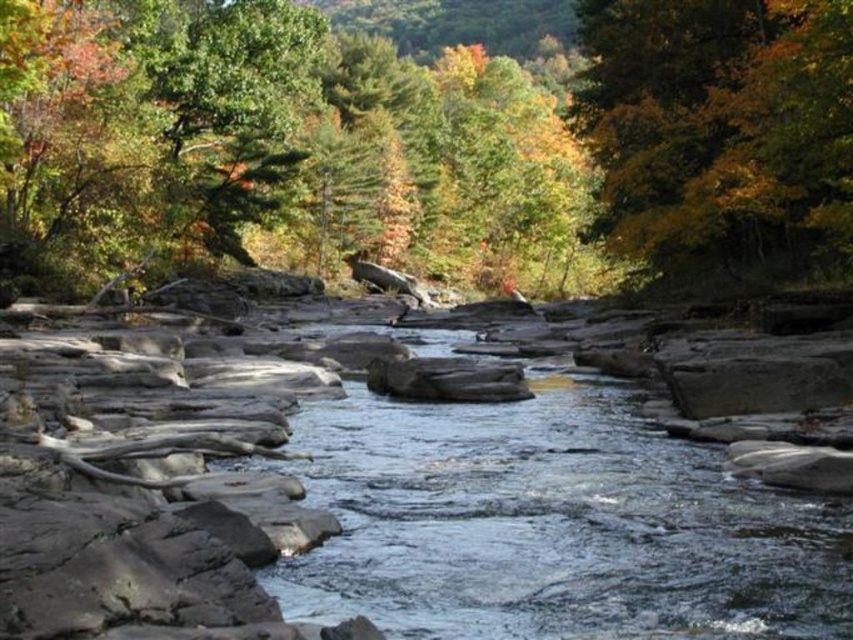
Question: Does green matte tree at upper center come in front of yellow-green leaves at upper right?

Choices:
 (A) no
 (B) yes

Answer: (A)

Question: Which of these objects is positioned farthest from the clear water at center?

Choices:
 (A) yellow-green leaves at upper right
 (B) green matte tree at upper center

Answer: (B)

Question: Is clear water at center positioned behind yellow-green leaves at upper right?

Choices:
 (A) no
 (B) yes

Answer: (A)

Question: Which object is the farthest from the green matte tree at upper center?

Choices:
 (A) clear water at center
 (B) yellow-green leaves at upper right

Answer: (A)

Question: Which object is the farthest from the clear water at center?

Choices:
 (A) green matte tree at upper center
 (B) yellow-green leaves at upper right

Answer: (A)

Question: Does clear water at center appear on the right side of yellow-green leaves at upper right?

Choices:
 (A) no
 (B) yes

Answer: (A)